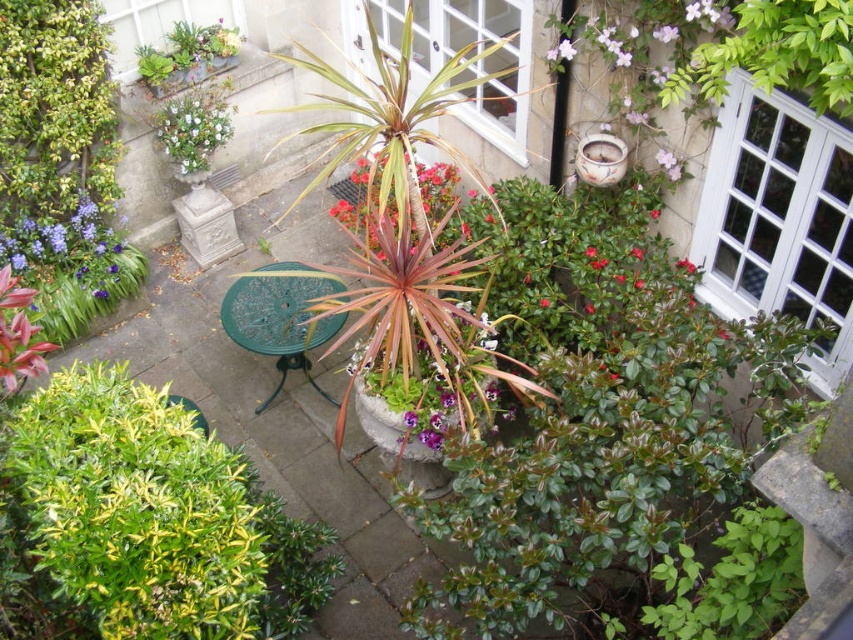
Can you confirm if green leafy bush at lower left is positioned to the right of purple glossy flower at upper center?

No, green leafy bush at lower left is not to the right of purple glossy flower at upper center.

Does green leafy bush at lower left lie in front of purple glossy flower at upper center?

No.

The width and height of the screenshot is (853, 640). Describe the element at coordinates (55, 109) in the screenshot. I see `green leafy bush at lower left` at that location.

You are a GUI agent. You are given a task and a screenshot of the screen. Output one action in this format:
    pyautogui.click(x=<x>, y=<y>)
    Task: Click on the green leafy bush at lower left
    
    Given the screenshot: What is the action you would take?
    pyautogui.click(x=55, y=109)

Who is more forward, (10,179) or (177,156)?

Point (10,179) is in front.

Can you confirm if green leafy bush at lower left is positioned to the right of white glossy vase at upper left?

Incorrect, green leafy bush at lower left is not on the right side of white glossy vase at upper left.

Which is in front, point (59, 160) or point (181, 157)?

Point (59, 160)

The height and width of the screenshot is (640, 853). Find the location of `green leafy bush at lower left`. green leafy bush at lower left is located at coordinates (55, 109).

Can you confirm if purple matte flower at lower left is wider than white glossy vase at upper left?

Yes.

From the picture: Can you confirm if purple matte flower at lower left is smaller than white glossy vase at upper left?

Actually, purple matte flower at lower left might be larger than white glossy vase at upper left.

Where is `purple matte flower at lower left`? Image resolution: width=853 pixels, height=640 pixels. purple matte flower at lower left is located at coordinates (64, 250).

The width and height of the screenshot is (853, 640). What are the coordinates of `purple matte flower at lower left` in the screenshot? It's located at (64, 250).